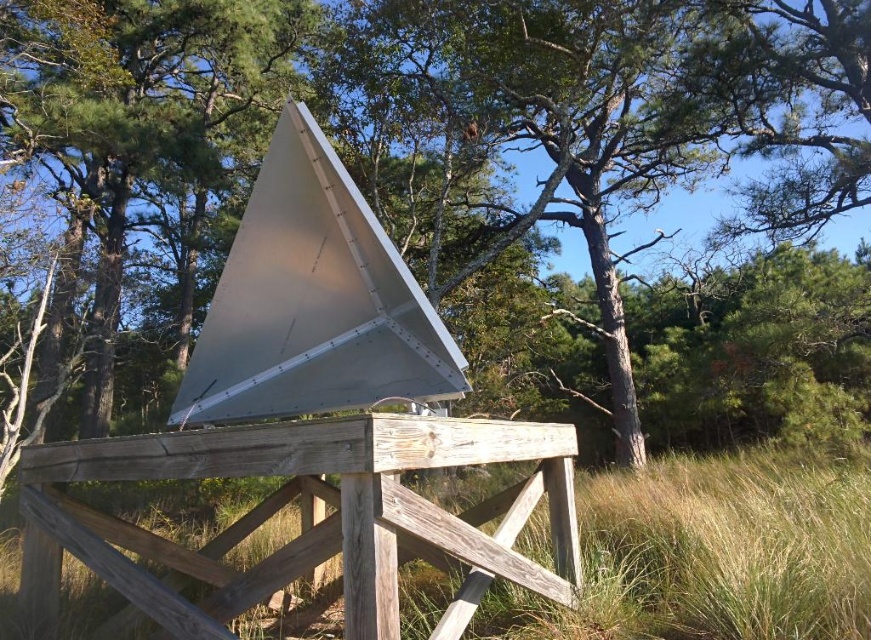
Does green leafy tree at upper center appear over grassy brown at center?

Correct, green leafy tree at upper center is located above grassy brown at center.

Is green leafy tree at upper center behind grassy brown at center?

Yes.

Which is in front, point (680, 88) or point (672, 618)?

Positioned in front is point (672, 618).

In order to click on green leafy tree at upper center in this screenshot , I will do `click(606, 125)`.